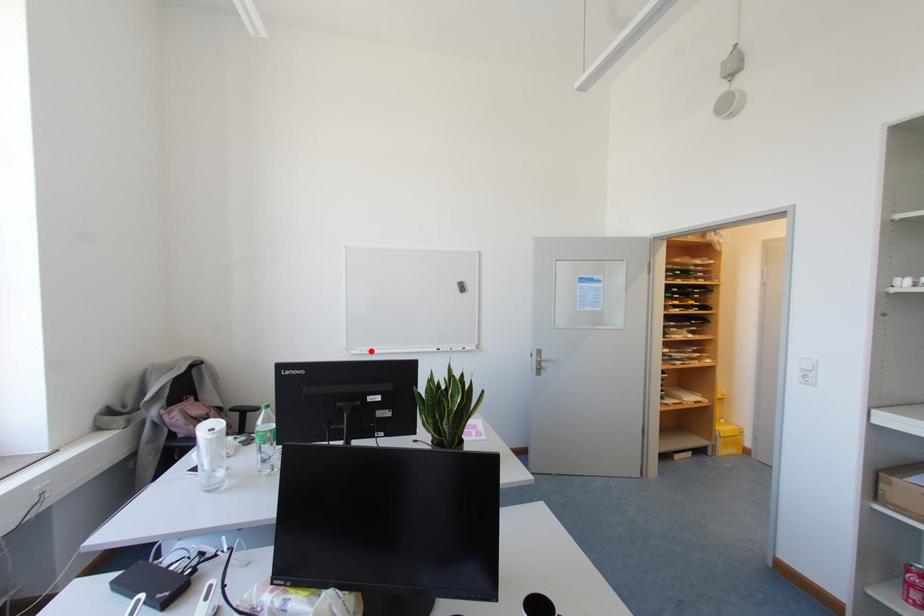
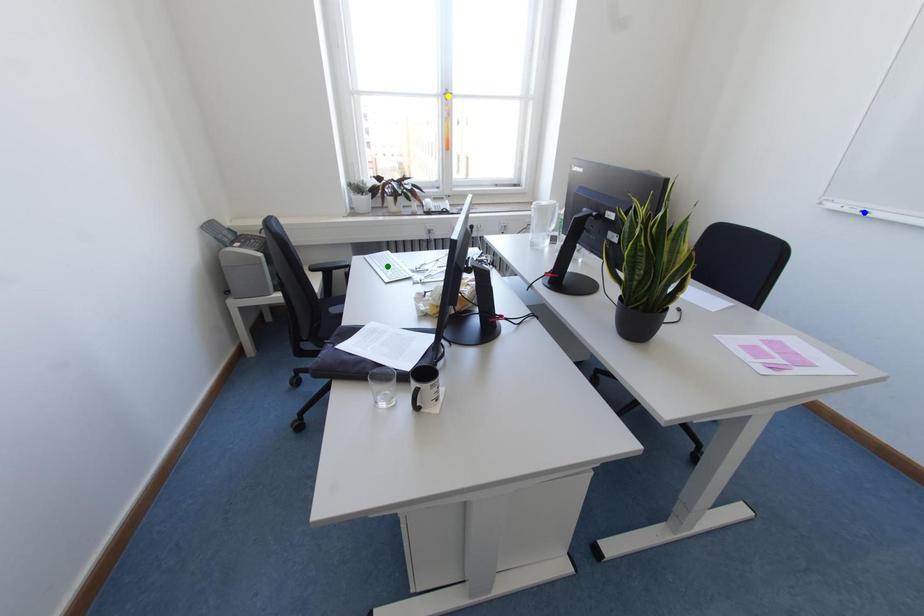
Question: I am providing you with two images of the same scene from different viewpoints. A red point is marked on the first image. You are given multiple points on the second image. Which spot in image 2 lines up with the point in image 1?

Choices:
 (A) green point
 (B) yellow point
 (C) blue point

Answer: (C)